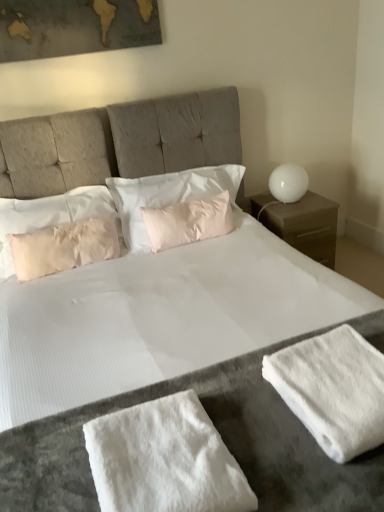
At what (x,y) coordinates should I click in order to perform the action: click on vacant space that is to the left of white fluffy towel at lower center. Please return your answer as a coordinate pair (x, y). The height and width of the screenshot is (512, 384). Looking at the image, I should click on pos(50,460).